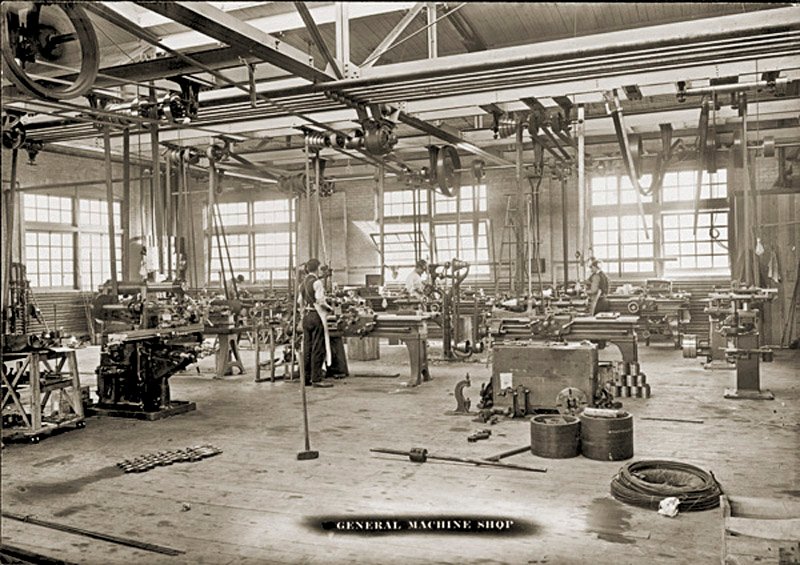
This screenshot has width=800, height=565. Identify the location of ceiling. (484, 28), (562, 19), (566, 20).